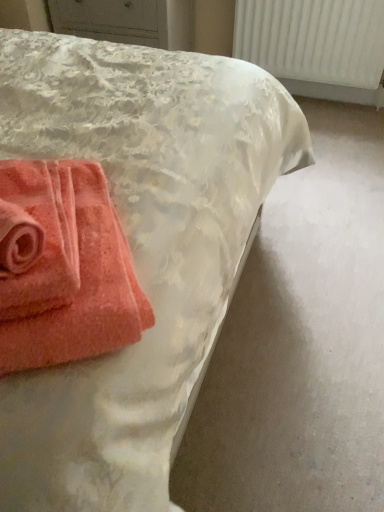
Question: Is point (292, 37) closer or farther from the camera than point (16, 160)?

Choices:
 (A) farther
 (B) closer

Answer: (A)

Question: From a real-world perspective, is white textured radiator at upper right above or below coral terry cloth towel at lower left, the 2th towel from the left?

Choices:
 (A) above
 (B) below

Answer: (B)

Question: Which of these objects is positioned closest to the coral soft towel at lower left, which is the first towel from left to right?

Choices:
 (A) coral terry cloth towel at lower left, marked as the first towel in a right-to-left arrangement
 (B) white textured radiator at upper right

Answer: (A)

Question: Estimate the real-world distances between objects in this image. Which object is farther from the white textured radiator at upper right?

Choices:
 (A) coral soft towel at lower left, which is the first towel from left to right
 (B) coral terry cloth towel at lower left, the 2th towel from the left

Answer: (A)